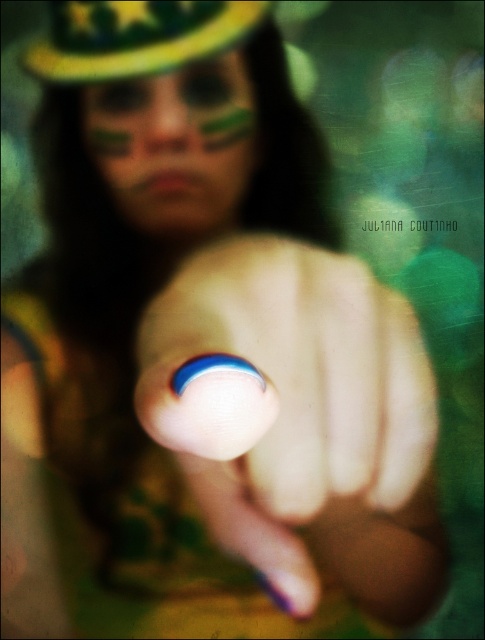
Can you confirm if matte green paint at center is smaller than yellow-green fabric hat at upper center?

No.

Is matte green paint at center closer to camera compared to yellow-green fabric hat at upper center?

No, matte green paint at center is further to the viewer.

Who is more distant from viewer, (187, 177) or (60, 45)?

The point (187, 177) is more distant.

The width and height of the screenshot is (485, 640). I want to click on matte green paint at center, so click(175, 145).

Which is above, blue painted nail at center or yellow-green fabric hat at upper center?

yellow-green fabric hat at upper center is higher up.

From the picture: Can you confirm if blue painted nail at center is positioned above yellow-green fabric hat at upper center?

No, blue painted nail at center is not above yellow-green fabric hat at upper center.

Who is more distant from viewer, (x=292, y=522) or (x=54, y=33)?

The point (x=292, y=522) is more distant.

Where is `blue painted nail at center`? Image resolution: width=485 pixels, height=640 pixels. blue painted nail at center is located at coordinates (300, 419).

Who is positioned more to the right, blue painted nail at center or matte green paint at center?

Positioned to the right is blue painted nail at center.

Who is more forward, (260, 518) or (93, 140)?

Point (260, 518) is more forward.

At what (x,y) coordinates should I click in order to perform the action: click on blue painted nail at center. Please return your answer as a coordinate pair (x, y). The height and width of the screenshot is (640, 485). Looking at the image, I should click on click(x=300, y=419).